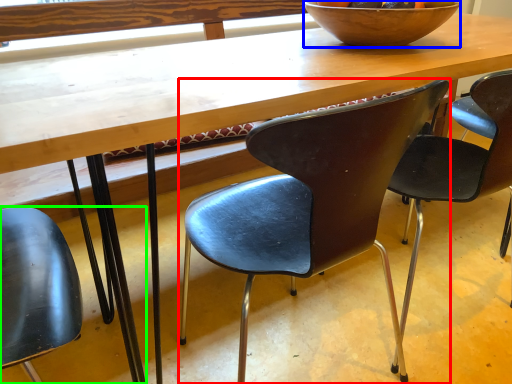
Question: Which object is positioned farthest from chair (highlighted by a red box)? Select from bowl (highlighted by a blue box) and chair (highlighted by a green box).

Choices:
 (A) bowl
 (B) chair

Answer: (B)